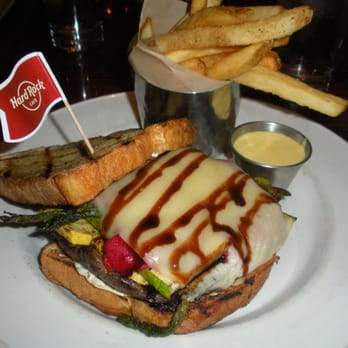
The width and height of the screenshot is (348, 348). Find the location of `dark wood table`. dark wood table is located at coordinates (96, 86).